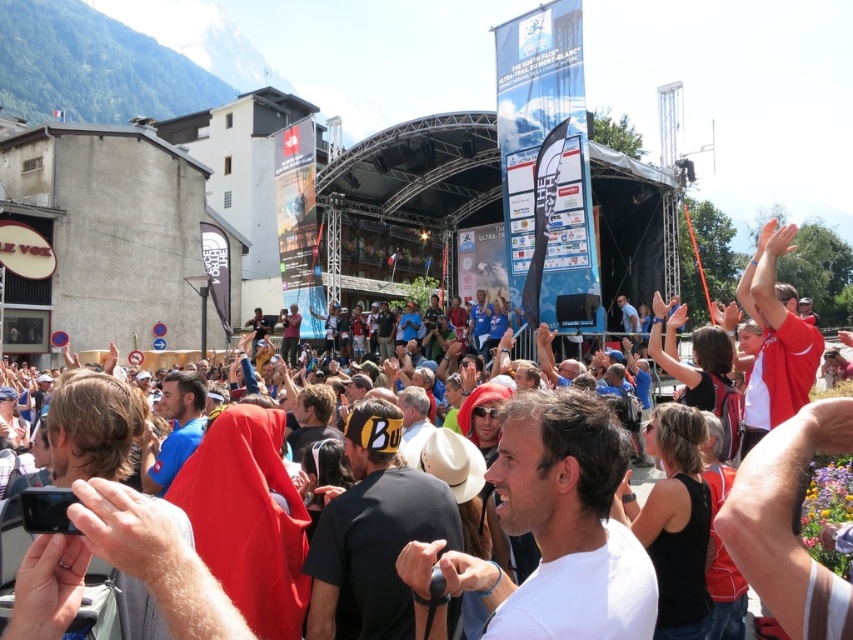
Is point (575, 620) farther from camera compared to point (143, 467)?

That is False.

Is white matte shirt at center above blue fabric shirt at center?

Incorrect, white matte shirt at center is not positioned above blue fabric shirt at center.

The image size is (853, 640). What are the coordinates of `white matte shirt at center` in the screenshot? It's located at (553, 531).

Consider the image. How much distance is there between yellow fabric hat at center and blue fabric shirt at center?

A distance of 55.36 feet exists between yellow fabric hat at center and blue fabric shirt at center.

Who is lower down, yellow fabric hat at center or blue fabric shirt at center?

yellow fabric hat at center is below.

Identify the location of yellow fabric hat at center. This screenshot has width=853, height=640. (373, 532).

Who is more distant from viewer, (x=581, y=596) or (x=403, y=477)?

Positioned behind is point (x=403, y=477).

In order to click on white matte shirt at center in this screenshot , I will do `click(553, 531)`.